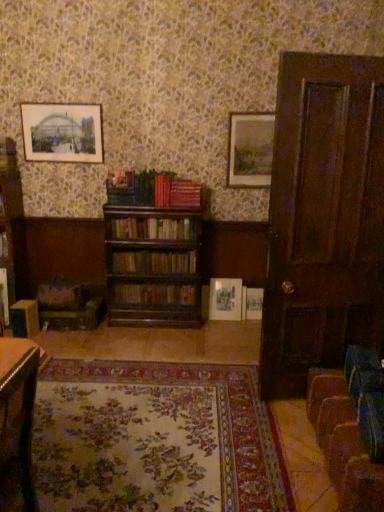
The image size is (384, 512). I want to click on floral carpet at center, so click(x=155, y=440).

Describe the element at coordinates (154, 262) in the screenshot. This screenshot has width=384, height=512. I see `wooden bookshelf at center, which is counted as the 2th book, starting from the bottom` at that location.

Measure the distance between point (193,263) and camera.

Point (193,263) and camera are 12.45 feet apart from each other.

In the scene shown: In order to face matte white picture frame at center, which appears as the first picture frame when ordered from the bottom, should I rotate leftwards or rightwards?

To align with it, rotate right about 9.172°.

What do you see at coordinates (254, 303) in the screenshot? This screenshot has height=512, width=384. I see `matte white picture frame at center, which appears as the first picture frame when ordered from the bottom` at bounding box center [254, 303].

Locate an element on the screen. This screenshot has width=384, height=512. wooden bookshelf at center, the third book positioned from the bottom is located at coordinates (153, 228).

This screenshot has width=384, height=512. What do you see at coordinates (62, 132) in the screenshot?
I see `black paper picture frame at upper left, arranged as the 4th picture frame when viewed from the right` at bounding box center [62, 132].

This screenshot has width=384, height=512. I want to click on dark wood door at right, so click(323, 218).

Is point (151, 218) positioned behind point (249, 308)?

No, (151, 218) is closer to viewer.

Is wooden bookshelf at center, which appears as the 2th book when viewed from the top, looking in the opposite direction of matte white picture frame at center, which appears as the first picture frame when ordered from the bottom?

wooden bookshelf at center, which appears as the 2th book when viewed from the top, is not turned away from matte white picture frame at center, which appears as the first picture frame when ordered from the bottom.

Which of these two, wooden bookshelf at center, the third book positioned from the bottom, or matte white picture frame at center, which ranks as the 4th picture frame in left-to-right order, stands shorter?

With less height is wooden bookshelf at center, the third book positioned from the bottom.

There is a matte white picture frame at center, placed as the 4th picture frame when sorted from top to bottom. In order to click on the 3rd book above it (from a real-world perspective) in this screenshot , I will do `click(153, 228)`.

Considering the relative sizes of matte white picture frame at center, which appears as the first picture frame when ordered from the bottom, and red leather book at center, marked as the fourth book in a bottom-to-top arrangement, in the image provided, is matte white picture frame at center, which appears as the first picture frame when ordered from the bottom, smaller than red leather book at center, marked as the fourth book in a bottom-to-top arrangement,?

Yes, matte white picture frame at center, which appears as the first picture frame when ordered from the bottom, is smaller than red leather book at center, marked as the fourth book in a bottom-to-top arrangement.

Between matte white picture frame at center, placed as the 4th picture frame when sorted from top to bottom, and red leather book at center, marked as the fourth book in a bottom-to-top arrangement, which one has smaller width?

matte white picture frame at center, placed as the 4th picture frame when sorted from top to bottom, is thinner.

Considering the relative positions of matte white picture frame at center, which appears as the first picture frame when ordered from the bottom, and red leather book at center, the first book positioned from the top, in the image provided, is matte white picture frame at center, which appears as the first picture frame when ordered from the bottom, to the left or to the right of red leather book at center, the first book positioned from the top,?

matte white picture frame at center, which appears as the first picture frame when ordered from the bottom, is positioned on red leather book at center, the first book positioned from the top,'s right side.

Considering the relative positions of floral carpet at center and matte gold picture frame at center, which is the third picture frame in right-to-left order, in the image provided, is floral carpet at center behind matte gold picture frame at center, which is the third picture frame in right-to-left order,?

No, floral carpet at center is closer to the camera.

You are a GUI agent. You are given a task and a screenshot of the screen. Output one action in this format:
    pyautogui.click(x=<x>, y=<y>)
    Task: Click on the 3rd picture frame behind the floral carpet at center, counting from the anchor's position
    This screenshot has width=384, height=512.
    Given the screenshot: What is the action you would take?
    pyautogui.click(x=225, y=298)

Who is bigger, floral carpet at center or matte gold picture frame at center, the third picture frame from the top?

With larger size is floral carpet at center.

Is wooden table at lower left positioned in front of red leather book at center, marked as the fourth book in a bottom-to-top arrangement?

Yes, wooden table at lower left is closer to the camera.

Does wooden table at lower left appear on the right side of red leather book at center, marked as the fourth book in a bottom-to-top arrangement?

No.

In terms of height, does wooden table at lower left look taller or shorter compared to red leather book at center, marked as the fourth book in a bottom-to-top arrangement?

Considering their sizes, wooden table at lower left has more height than red leather book at center, marked as the fourth book in a bottom-to-top arrangement.

From a real-world perspective, is wooden table at lower left beneath red leather book at center, marked as the fourth book in a bottom-to-top arrangement?

Indeed, from a real-world perspective, wooden table at lower left is positioned beneath red leather book at center, marked as the fourth book in a bottom-to-top arrangement.

Is floral carpet at center at the back of wooden bookshelf at center, the third book positioned from the bottom?

No.

Does wooden bookshelf at center, which appears as the 2th book when viewed from the top, have a greater width compared to floral carpet at center?

No.

From a real-world perspective, which is physically below, wooden bookshelf at center, the third book positioned from the bottom, or floral carpet at center?

floral carpet at center, from a real-world perspective.

Considering the sizes of matte gold picture frame at center, which ranks as the 2th picture frame in bottom-to-top order, and velvet brown swivel chair at lower right, which is the 1th swivel chair from right to left, in the image, is matte gold picture frame at center, which ranks as the 2th picture frame in bottom-to-top order, taller or shorter than velvet brown swivel chair at lower right, which is the 1th swivel chair from right to left,?

Considering their sizes, matte gold picture frame at center, which ranks as the 2th picture frame in bottom-to-top order, has more height than velvet brown swivel chair at lower right, which is the 1th swivel chair from right to left.

This screenshot has height=512, width=384. I want to click on the 2nd picture frame above the velvet brown swivel chair at lower right, the 2th swivel chair from the left (from the image's perspective), so click(225, 298).

Which is farther from the camera, (214, 309) or (366, 445)?

The point (214, 309) is farther.

Can you tell me how much red leather book at center, the first book positioned from the top, and brown wooden bookcase at left differ in facing direction?

The angle between the facing direction of red leather book at center, the first book positioned from the top, and the facing direction of brown wooden bookcase at left is 0.845 degrees.

Is red leather book at center, the first book positioned from the top, facing towards brown wooden bookcase at left?

No, red leather book at center, the first book positioned from the top, is not oriented towards brown wooden bookcase at left.

Which is in front, point (159, 205) or point (16, 251)?

The point (159, 205) is more forward.

Is red leather book at center, the first book positioned from the top, next to brown wooden bookcase at left?

red leather book at center, the first book positioned from the top, and brown wooden bookcase at left are not in contact.

Identify the location of the 3rd picture frame counting from the right of the wooden bookshelf at center, which appears as the 2th book when viewed from the top. (254, 303).

I want to click on picture frame that is the 2nd one below the red leather book at center, the first book positioned from the top (from a real-world perspective), so click(x=254, y=303).

When comparing their distances from wooden bookshelf at center, the third book positioned from the bottom, does matte gold picture frame at center, which appears as the 2th picture frame when viewed from the left, or matte white picture frame at center, marked as the 1th picture frame in a right-to-left arrangement, seem closer?

Among the two, matte gold picture frame at center, which appears as the 2th picture frame when viewed from the left, is located nearer to wooden bookshelf at center, the third book positioned from the bottom.

From the image, which object appears to be nearer to dark wood door at right, wooden bookshelf at center, which is counted as the 3th book, starting from the top, or floral carpet at center?

floral carpet at center is positioned closer to the anchor dark wood door at right.

From the picture: From the image, which object appears to be nearer to wooden swivel chair at lower left, the 2th swivel chair ordered from the bottom, wooden bookshelf at center, which appears as the 2th book when viewed from the top, or wooden table at lower left?

Based on the image, wooden bookshelf at center, which appears as the 2th book when viewed from the top, appears to be nearer to wooden swivel chair at lower left, the 2th swivel chair ordered from the bottom.

When comparing their distances from dark wood door at right, does wooden table at lower left or wooden bookshelf at center, which is the 1th book in bottom-to-top order, seem closer?

wooden bookshelf at center, which is the 1th book in bottom-to-top order, is positioned closer to the anchor dark wood door at right.

Based on their spatial positions, is matte wooden picture frame at upper right, the third picture frame when ordered from bottom to top, or wooden bookshelf at center, which is counted as the 2th book, starting from the bottom, further from red leather book at center, marked as the fourth book in a bottom-to-top arrangement?

matte wooden picture frame at upper right, the third picture frame when ordered from bottom to top, is further to red leather book at center, marked as the fourth book in a bottom-to-top arrangement.

When comparing their distances from wooden table at lower left, does matte white picture frame at center, placed as the 4th picture frame when sorted from top to bottom, or brown wooden bookcase at left seem closer?

brown wooden bookcase at left is positioned closer to the anchor wooden table at lower left.

When comparing their distances from black paper picture frame at upper left, arranged as the first picture frame when viewed from the left, does dark wood door at right or matte white picture frame at center, placed as the 4th picture frame when sorted from top to bottom, seem further?

dark wood door at right.

Which object lies nearer to the anchor point black paper picture frame at upper left, arranged as the 4th picture frame when viewed from the right, wooden bookshelf at center, the third book positioned from the bottom, or matte white picture frame at center, marked as the 1th picture frame in a right-to-left arrangement?

wooden bookshelf at center, the third book positioned from the bottom, is closer to black paper picture frame at upper left, arranged as the 4th picture frame when viewed from the right.

The width and height of the screenshot is (384, 512). I want to click on book between floral carpet at center and wooden bookshelf at center, the third book positioned from the bottom, from front to back, so click(176, 192).

Locate an element on the screen. swivel chair between wooden table at lower left and black paper picture frame at upper left, arranged as the first picture frame when viewed from the left, along the z-axis is located at coordinates (351, 428).

Where is `bookcase between black paper picture frame at upper left, arranged as the first picture frame when viewed from the left, and wooden bookshelf at center, acting as the 4th book starting from the top, in the up-down direction`? bookcase between black paper picture frame at upper left, arranged as the first picture frame when viewed from the left, and wooden bookshelf at center, acting as the 4th book starting from the top, in the up-down direction is located at coordinates (11, 225).

Locate an element on the screen. The image size is (384, 512). blanket located between brown wooden bookcase at left and matte wooden picture frame at upper right, placed as the second picture frame when sorted from right to left, in the left-right direction is located at coordinates (155, 440).